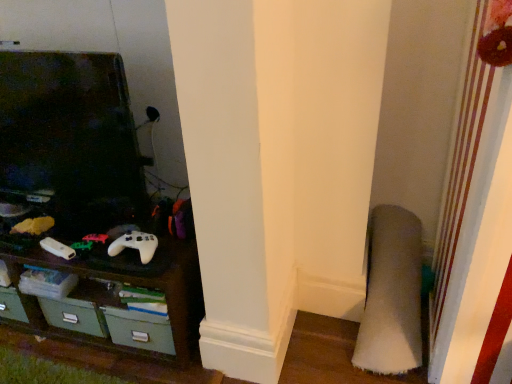
Where is `free location to the right of white matte game controller at center, the second game controller from the left`? This screenshot has height=384, width=512. free location to the right of white matte game controller at center, the second game controller from the left is located at coordinates (173, 252).